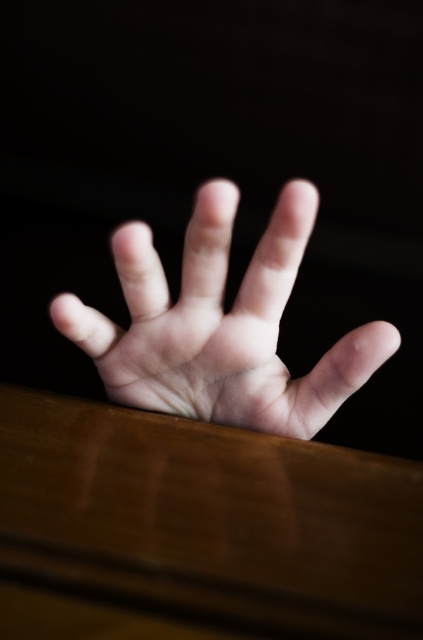
You are trying to place a small object on the brown polished wood table at lower center. Based on the coordinates provided in the description, where exactly should you aim to place it?

The brown polished wood table at lower center is located at point (x=209, y=518), so you should aim for that coordinate to place the small object there.

From the picture: You are a painter who wants to paint the brown polished wood table at lower center and the pale skin hand at center. Which object is wider?

The brown polished wood table at lower center is wider than the pale skin hand at center.

You are trying to place a small object on the brown polished wood table at lower center. Is the pale skin hand at center currently blocking the table?

The brown polished wood table at lower center is below the pale skin hand at center, so the hand is blocking the table.